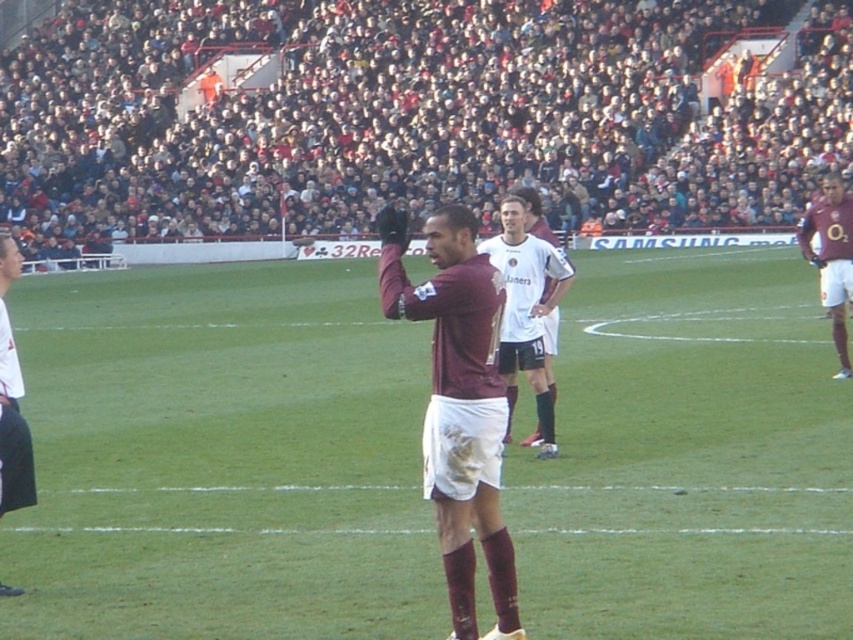
Question: Considering the real-world distances, which object is farthest from the white jersey at center?

Choices:
 (A) white jersey at left
 (B) burgundy jersey at center
 (C) maroon jersey at center
 (D) dark red fabric crowd at upper center

Answer: (D)

Question: Which of the following is the closest to the observer?

Choices:
 (A) (830, 186)
 (B) (45, 250)

Answer: (A)

Question: Which point appears farthest from the camera in this image?

Choices:
 (A) (16, 589)
 (B) (520, 285)

Answer: (B)

Question: Can you confirm if white jersey at center is wider than maroon jersey at center?

Choices:
 (A) yes
 (B) no

Answer: (B)

Question: Is burgundy jersey at center further to camera compared to white jersey at left?

Choices:
 (A) yes
 (B) no

Answer: (B)

Question: From the image, what is the correct spatial relationship of burgundy jersey at center in relation to maroon jersey at center?

Choices:
 (A) above
 (B) below

Answer: (B)